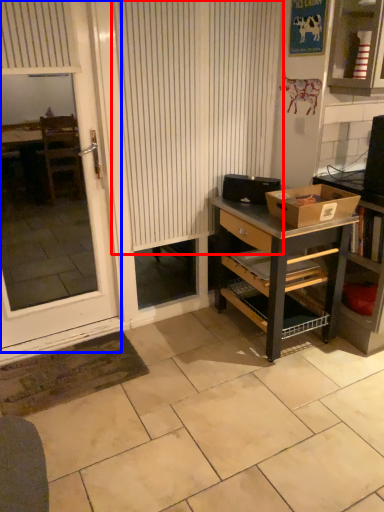
Question: Among these objects, which one is nearest to the camera, curtain (highlighted by a red box) or screen door (highlighted by a blue box)?

Choices:
 (A) curtain
 (B) screen door

Answer: (B)